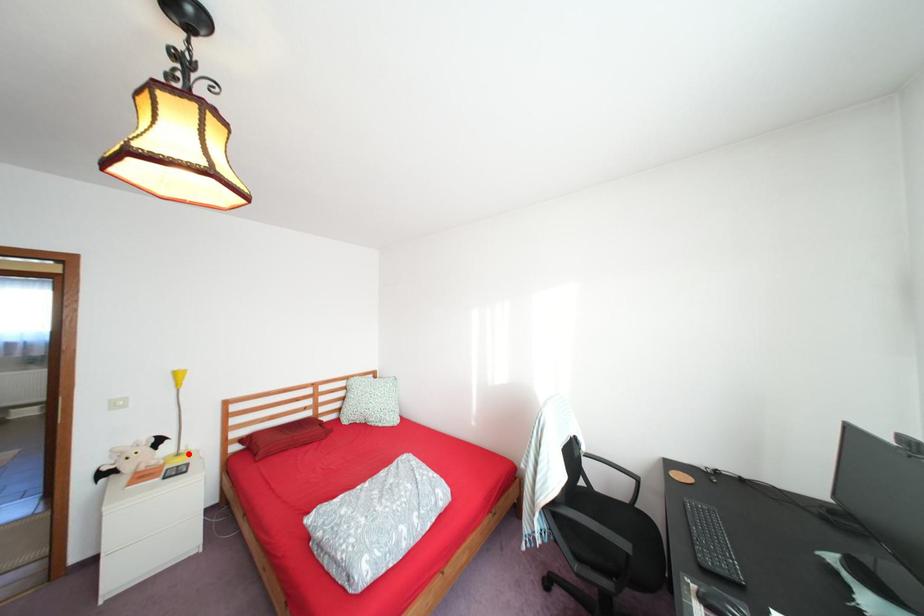
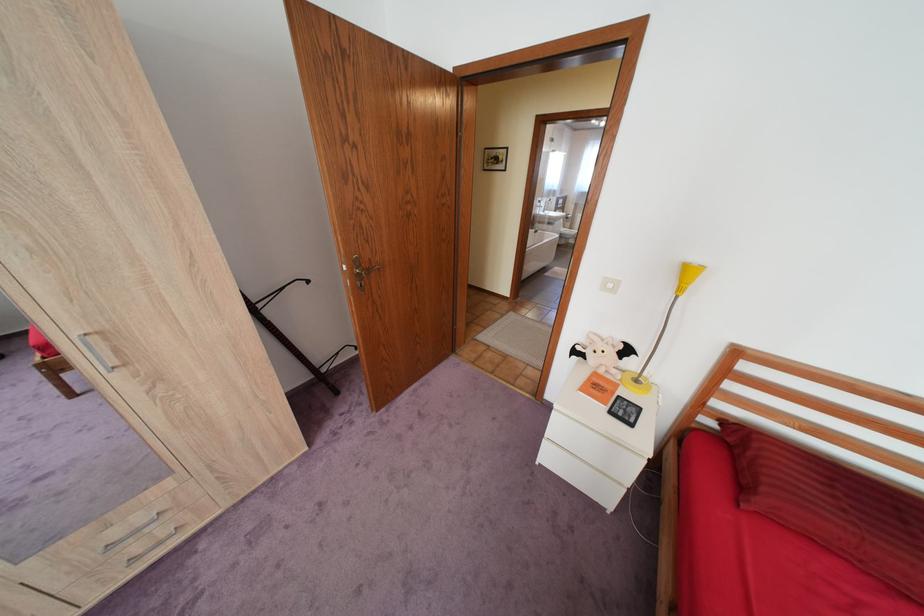
Find the pixel in the second image that matches the highlighted location in the first image.

(648, 379)